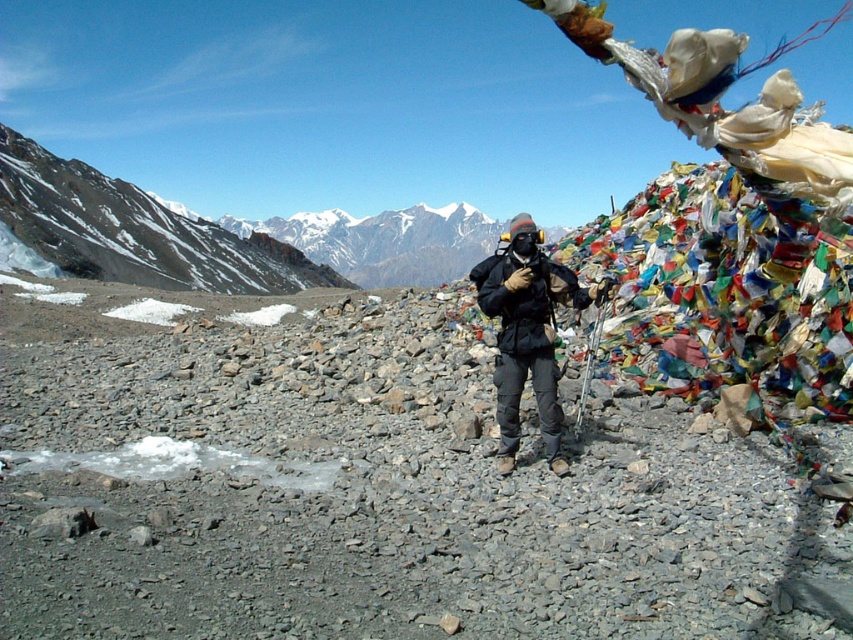
You are a hiker who wants to place a small flag on the highest point between the gray gravel at center and the black matte jacket at center. Which object should you choose to place the flag on?

The black matte jacket at center has a greater height than the gray gravel at center, so you should place the flag on the black matte jacket at center.

You are a hiker trying to navigate the rocky terrain in the mountain. You see two points marked on your map corresponding to coordinates point (x=384, y=611) and point (x=561, y=280). Which point should you choose to reach the camera position faster?

Point (x=384, y=611) is closer to the camera than point (x=561, y=280), so choosing point (x=384, y=611) would allow you to reach the camera position faster.